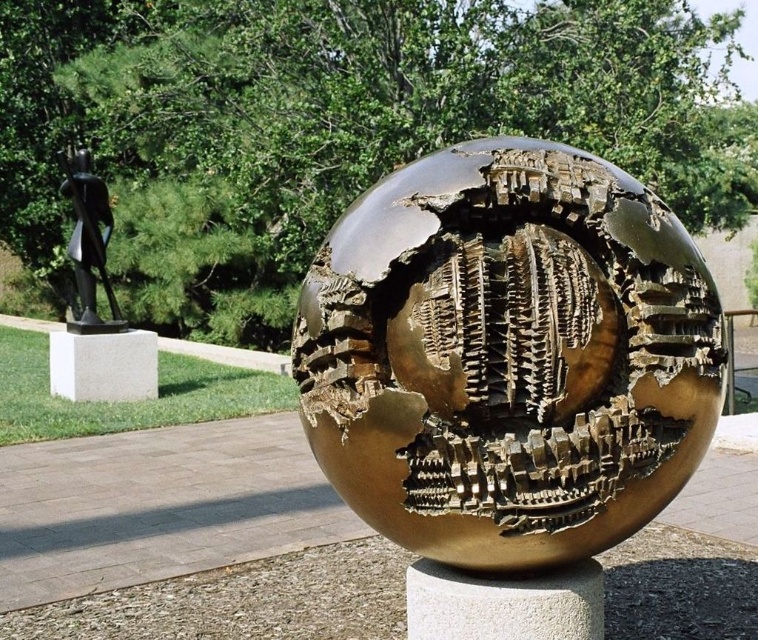
Question: Among these points, which one is nearest to the camera?

Choices:
 (A) (77, 179)
 (B) (493, 592)
 (C) (152, 376)

Answer: (B)

Question: Which of the following is the closest to the observer?

Choices:
 (A) (139, 349)
 (B) (371, 192)

Answer: (B)

Question: Is white stone pillar at center thinner than bronze statue at left?

Choices:
 (A) no
 (B) yes

Answer: (B)

Question: Does gold textured sphere at center appear on the right side of white stone pillar at center?

Choices:
 (A) yes
 (B) no

Answer: (A)

Question: Which object is positioned closest to the bronze statue at left?

Choices:
 (A) gold textured sphere at center
 (B) white marble pillar at lower left
 (C) white stone pillar at center

Answer: (B)

Question: Is white stone pillar at center positioned at the back of bronze statue at left?

Choices:
 (A) yes
 (B) no

Answer: (B)